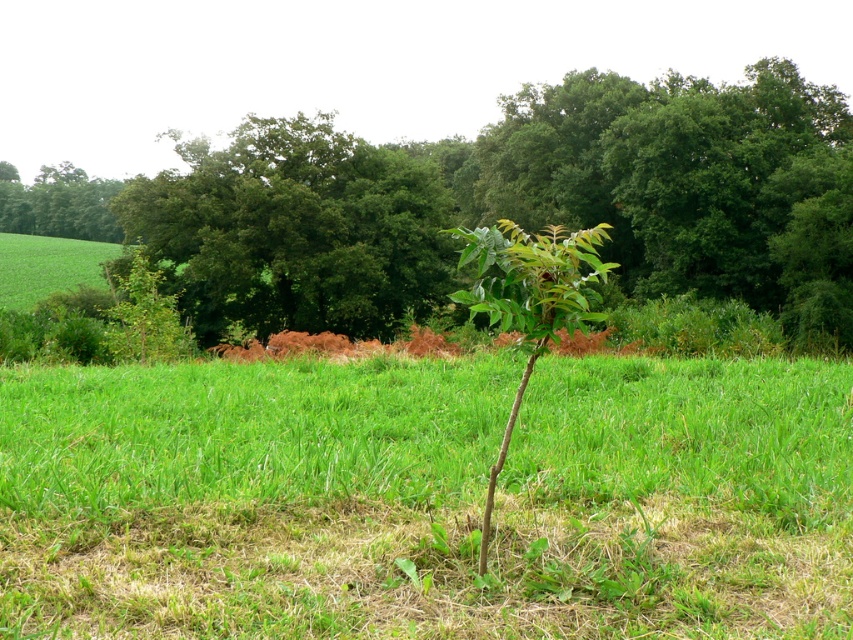
Question: Is green leafy tree at center positioned in front of green leafy tree at upper left?

Choices:
 (A) yes
 (B) no

Answer: (A)

Question: Which point appears farthest from the camera in this image?

Choices:
 (A) (21, 186)
 (B) (828, 291)
 (C) (287, 282)
 (D) (524, 337)

Answer: (A)

Question: Can you confirm if green matte plant at center is positioned below green leafy tree at upper left?

Choices:
 (A) no
 (B) yes

Answer: (B)

Question: Which point appears farthest from the camera in this image?

Choices:
 (A) (525, 294)
 (B) (444, 253)

Answer: (B)

Question: Among these points, which one is nearest to the camera?

Choices:
 (A) (483, 292)
 (B) (785, 99)
 (C) (225, 333)
 (D) (109, 189)

Answer: (A)

Question: Can you confirm if green matte plant at center is positioned below green leafy tree at upper left?

Choices:
 (A) yes
 (B) no

Answer: (A)